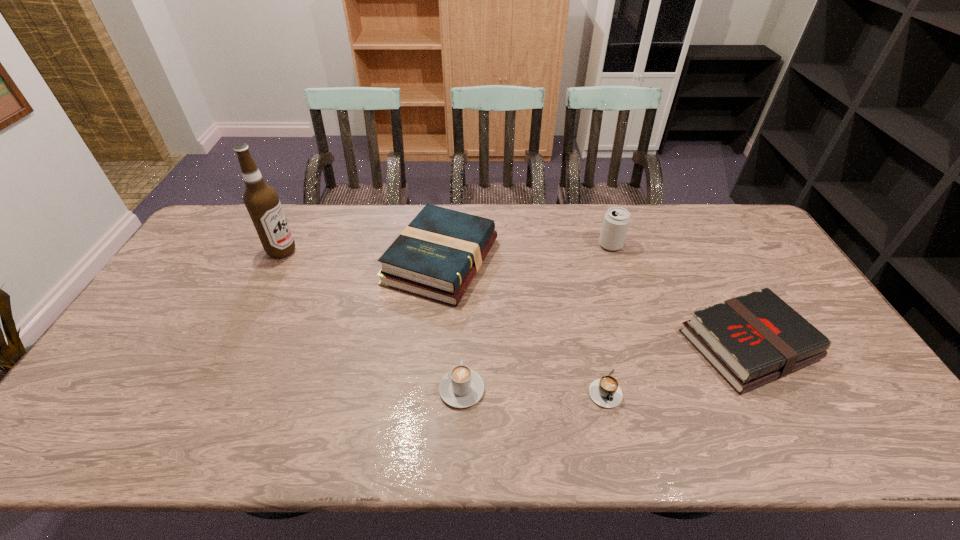
At what (x,y) coordinates should I click in order to perform the action: click on can that is at the far edge. Please return your answer as a coordinate pair (x, y). The height and width of the screenshot is (540, 960). Looking at the image, I should click on (616, 221).

This screenshot has width=960, height=540. Identify the location of hardback book at the far edge. (436, 256).

Locate an element on the screen. Image resolution: width=960 pixels, height=540 pixels. object that is at the right edge is located at coordinates (x=750, y=340).

Find the location of a particular element. vacant region at the far edge of the desktop is located at coordinates (662, 206).

Where is `free space at the left edge of the desktop`? free space at the left edge of the desktop is located at coordinates (208, 249).

I want to click on vacant space at the right edge of the desktop, so click(757, 247).

In the image, there is a desktop. Identify the location of free space at the near left corner. This screenshot has height=540, width=960. (54, 449).

This screenshot has width=960, height=540. In order to click on free location at the far right corner of the desktop in this screenshot , I will do `click(732, 224)`.

Locate an element on the screen. Image resolution: width=960 pixels, height=540 pixels. free space between the leftmost object and the shorter cappuccino is located at coordinates (443, 320).

At what (x,y) coordinates should I click in order to perform the action: click on free spot between the left cappuccino and the fifth shortest object. Please return your answer as a coordinate pair (x, y). Looking at the image, I should click on (536, 317).